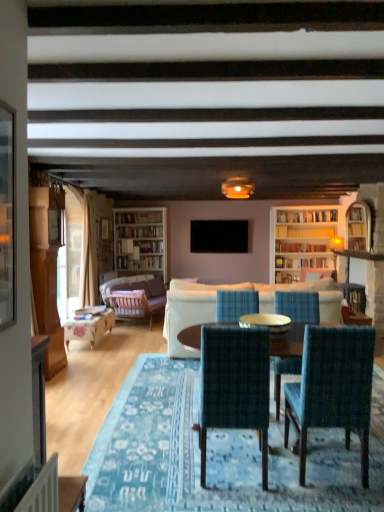
You are a GUI agent. You are given a task and a screenshot of the screen. Output one action in this format:
    pyautogui.click(x=<x>, y=<y>)
    Task: Click on the clear glass table at center
    This screenshot has height=512, width=384.
    Given the screenshot: What is the action you would take?
    pyautogui.click(x=266, y=321)

What is the approximate height of clear glass table at center?

clear glass table at center is 5.82 inches in height.

What is the approximate width of wooden round table at center?

It is 1.06 meters.

The height and width of the screenshot is (512, 384). What do you see at coordinates (333, 388) in the screenshot? I see `teal fabric chair at center, the second chair when ordered from back to front` at bounding box center [333, 388].

Where is `teal fabric chair at center, the second chair when ordered from back to front`? teal fabric chair at center, the second chair when ordered from back to front is located at coordinates (333, 388).

Describe the element at coordinates (215, 306) in the screenshot. I see `white fabric couch at center, which is counted as the 2th studio couch, starting from the back` at that location.

At what (x,y) coordinates should I click in order to perform the action: click on blue woven chair at center, which is counted as the 3th chair, starting from the front. Please return your answer as a coordinate pair (x, y). The image size is (384, 512). Looking at the image, I should click on (x=235, y=304).

The image size is (384, 512). What do you see at coordinates (235, 304) in the screenshot?
I see `blue woven chair at center, acting as the 1th chair starting from the back` at bounding box center [235, 304].

In order to click on clear glass table at center in this screenshot , I will do `click(266, 321)`.

Is velvet blue armchair at center, positioned as the 2th armchair in front-to-back order, positioned behind clear glass table at center?

Yes, velvet blue armchair at center, positioned as the 2th armchair in front-to-back order, is further from the camera.

Is velvet blue armchair at center, which is counted as the 1th armchair, starting from the right, bigger than clear glass table at center?

Correct, velvet blue armchair at center, which is counted as the 1th armchair, starting from the right, is larger in size than clear glass table at center.

Is velvet blue armchair at center, which is counted as the 1th armchair, starting from the right, aimed at clear glass table at center?

No, velvet blue armchair at center, which is counted as the 1th armchair, starting from the right, is not oriented towards clear glass table at center.

Where is `glass table that appears above the velvet blue armchair at center, which is counted as the 1th armchair, starting from the right (from a real-world perspective)`? glass table that appears above the velvet blue armchair at center, which is counted as the 1th armchair, starting from the right (from a real-world perspective) is located at coordinates (266, 321).

Are black matte television at center and white fabric couch at center, which is counted as the 2th studio couch, starting from the back, far apart?

That's right, there is a large distance between black matte television at center and white fabric couch at center, which is counted as the 2th studio couch, starting from the back.

Is black matte television at center turned away from white fabric couch at center, the second studio couch when ordered from left to right?

No, black matte television at center's orientation is not away from white fabric couch at center, the second studio couch when ordered from left to right.

What are the coordinates of `the 2nd studio couch in front of the black matte television at center, counting from the anchor's position` in the screenshot? It's located at (215, 306).

Looking at this image, from a real-world perspective, is velvet purple sofa at center, placed as the 1th studio couch when sorted from back to front, positioned over blue woven chair at center, acting as the 1th chair starting from the back, based on gravity?

Incorrect, from a real-world perspective, velvet purple sofa at center, placed as the 1th studio couch when sorted from back to front, is lower than blue woven chair at center, acting as the 1th chair starting from the back.

Between velvet purple sofa at center, acting as the second studio couch starting from the front, and blue woven chair at center, which is counted as the 3th chair, starting from the front, which one has less height?

Standing shorter between the two is blue woven chair at center, which is counted as the 3th chair, starting from the front.

Looking at this image, which of these two, velvet purple sofa at center, placed as the 1th studio couch when sorted from back to front, or blue woven chair at center, acting as the 1th chair starting from the back, is wider?

Wider between the two is velvet purple sofa at center, placed as the 1th studio couch when sorted from back to front.

At what (x,y) coordinates should I click in order to perform the action: click on the 2nd studio couch below when counting from the blue woven chair at center, acting as the 1th chair starting from the back (from the image's perspective). Please return your answer as a coordinate pair (x, y). Looking at the image, I should click on (135, 296).

Considering the relative sizes of velvet purple sofa at center, which is the second studio couch from right to left, and white wooden bookcase at left in the image provided, is velvet purple sofa at center, which is the second studio couch from right to left, shorter than white wooden bookcase at left?

Correct, velvet purple sofa at center, which is the second studio couch from right to left, is not as tall as white wooden bookcase at left.

Does velvet purple sofa at center, which is the second studio couch from right to left, turn towards white wooden bookcase at left?

No, velvet purple sofa at center, which is the second studio couch from right to left, does not turn towards white wooden bookcase at left.

Considering the sizes of velvet purple sofa at center, which is the first studio couch from left to right, and white wooden bookcase at left in the image, is velvet purple sofa at center, which is the first studio couch from left to right, wider or thinner than white wooden bookcase at left?

velvet purple sofa at center, which is the first studio couch from left to right, is wider than white wooden bookcase at left.

Who is more distant, velvet purple sofa at center, acting as the second studio couch starting from the front, or white wooden bookcase at left?

white wooden bookcase at left is further from the camera.

Which point is more distant from viewer, (111,302) or (78,321)?

The point (111,302) is farther from the camera.

Are wooden armchair at center, the 2th armchair positioned from the right, and wooden floral-patterned table at left located far from each other?

No, wooden armchair at center, the 2th armchair positioned from the right, is not far from wooden floral-patterned table at left.

Is wooden armchair at center, the second armchair viewed from the back, not within wooden floral-patterned table at left?

That's correct, wooden armchair at center, the second armchair viewed from the back, is outside of wooden floral-patterned table at left.

In terms of size, does wooden armchair at center, the second armchair viewed from the back, appear bigger or smaller than wooden floral-patterned table at left?

In the image, wooden armchair at center, the second armchair viewed from the back, appears to be smaller than wooden floral-patterned table at left.

Considering the relative sizes of dark blue woven chair at center, the 3th chair when ordered from back to front, and clear glass table at center in the image provided, is dark blue woven chair at center, the 3th chair when ordered from back to front, taller than clear glass table at center?

Indeed, dark blue woven chair at center, the 3th chair when ordered from back to front, has a greater height compared to clear glass table at center.

Between dark blue woven chair at center, the 3th chair when ordered from back to front, and clear glass table at center, which one is positioned in front?

Positioned in front is dark blue woven chair at center, the 3th chair when ordered from back to front.

Considering the positions of objects dark blue woven chair at center, the 3th chair when ordered from back to front, and clear glass table at center in the image provided, who is more to the left, dark blue woven chair at center, the 3th chair when ordered from back to front, or clear glass table at center?

From the viewer's perspective, dark blue woven chair at center, the 3th chair when ordered from back to front, appears more on the left side.

How different are the orientations of dark blue woven chair at center, which is the 1th chair from front to back, and clear glass table at center in degrees?

There is a 4.21-degree angle between the facing directions of dark blue woven chair at center, which is the 1th chair from front to back, and clear glass table at center.

Does point (239, 307) come closer to viewer compared to point (160, 289)?

Yes.

How many degrees apart are the facing directions of blue woven chair at center, which is counted as the 3th chair, starting from the front, and velvet purple sofa at center, acting as the second studio couch starting from the front?

70.7 degrees separate the facing orientations of blue woven chair at center, which is counted as the 3th chair, starting from the front, and velvet purple sofa at center, acting as the second studio couch starting from the front.

From a real-world perspective, is blue woven chair at center, acting as the 1th chair starting from the back, positioned above or below velvet purple sofa at center, which is the first studio couch from left to right?

From a real-world perspective, blue woven chair at center, acting as the 1th chair starting from the back, is physically above velvet purple sofa at center, which is the first studio couch from left to right.

Considering the sizes of objects blue woven chair at center, acting as the 1th chair starting from the back, and velvet purple sofa at center, which is the second studio couch from right to left, in the image provided, who is bigger, blue woven chair at center, acting as the 1th chair starting from the back, or velvet purple sofa at center, which is the second studio couch from right to left,?

With larger size is velvet purple sofa at center, which is the second studio couch from right to left.

The image size is (384, 512). I want to click on armchair that is the 1st object directly below the clear glass table at center (from a real-world perspective), so click(315, 273).

Find the location of a particular element. The width and height of the screenshot is (384, 512). television lying behind the white fabric couch at center, which is counted as the 2th studio couch, starting from the back is located at coordinates (219, 236).

Looking at the image, which one is located closer to beige fabric curtain at left, wooden floral-patterned table at left or white fabric couch at center, the second studio couch when ordered from left to right?

wooden floral-patterned table at left lies closer to beige fabric curtain at left than the other object.

Based on their spatial positions, is wooden floral-patterned table at left or blue woven chair at center, which is counted as the 3th chair, starting from the front, further from beige fabric curtain at left?

Among the two, blue woven chair at center, which is counted as the 3th chair, starting from the front, is located further to beige fabric curtain at left.

Based on the photo, looking at the image, which one is located further to teal fabric chair at center, the second chair when ordered from back to front, wooden round table at center or velvet purple sofa at center, which is the second studio couch from right to left?

velvet purple sofa at center, which is the second studio couch from right to left, lies further to teal fabric chair at center, the second chair when ordered from back to front, than the other object.

Looking at the image, which one is located closer to clear glass table at center, beige fabric curtain at left or blue woven chair at center, acting as the 1th chair starting from the back?

blue woven chair at center, acting as the 1th chair starting from the back, is closer to clear glass table at center.

Based on their spatial positions, is clear glass table at center or velvet purple sofa at center, which is the second studio couch from right to left, closer to dark blue woven chair at center, the 3th chair when ordered from back to front?

Based on the image, clear glass table at center appears to be nearer to dark blue woven chair at center, the 3th chair when ordered from back to front.

When comparing their distances from white fabric couch at center, the second studio couch when ordered from left to right, does beige fabric curtain at left or wooden cabinet at left seem further?

beige fabric curtain at left lies further to white fabric couch at center, the second studio couch when ordered from left to right, than the other object.

When comparing their distances from beige fabric curtain at left, does wooden round table at center or wooden floral-patterned table at left seem further?

The object further to beige fabric curtain at left is wooden round table at center.

Based on their spatial positions, is beige fabric curtain at left or wooden cabinet at left further from teal fabric chair at center, the second chair when ordered from back to front?

beige fabric curtain at left.

Find the location of a particular element. Image resolution: width=384 pixels, height=512 pixels. chair between teal fabric chair at center, the second chair when ordered from back to front, and white fabric couch at center, the second studio couch when ordered from left to right, from front to back is located at coordinates (235, 304).

Locate an element on the screen. curtain located between white fabric couch at center, positioned as the 1th studio couch in front-to-back order, and white wooden bookcase at left in the depth direction is located at coordinates (88, 254).

Locate an element on the screen. The width and height of the screenshot is (384, 512). cabinetry located between dark blue woven chair at center, the 3th chair when ordered from back to front, and velvet blue armchair at center, positioned as the 2th armchair in front-to-back order, in the depth direction is located at coordinates [x=47, y=270].

Locate an element on the screen. coffee table between dark blue woven chair at center, which is the 1th chair from front to back, and velvet blue armchair at center, which is counted as the 1th armchair, starting from the right, from front to back is located at coordinates (288, 342).